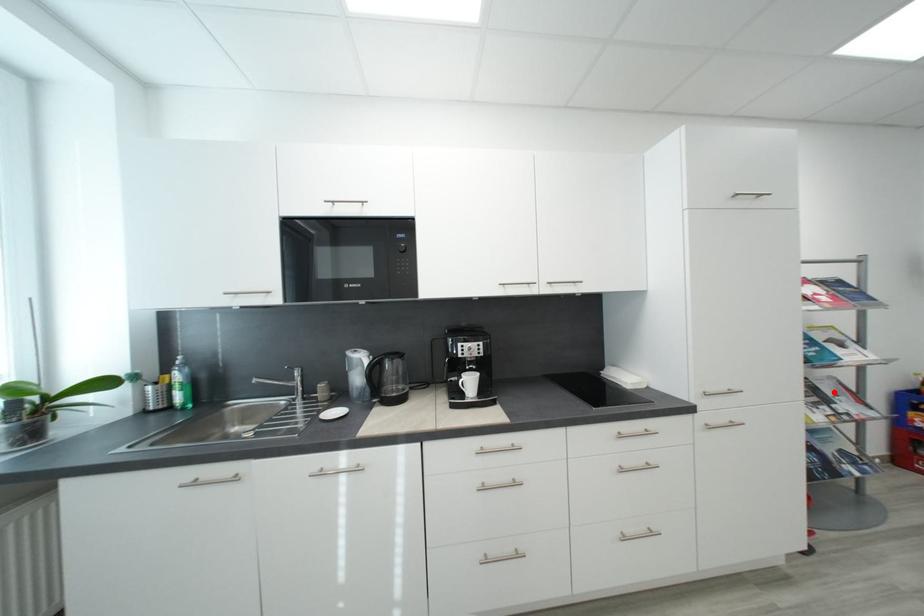
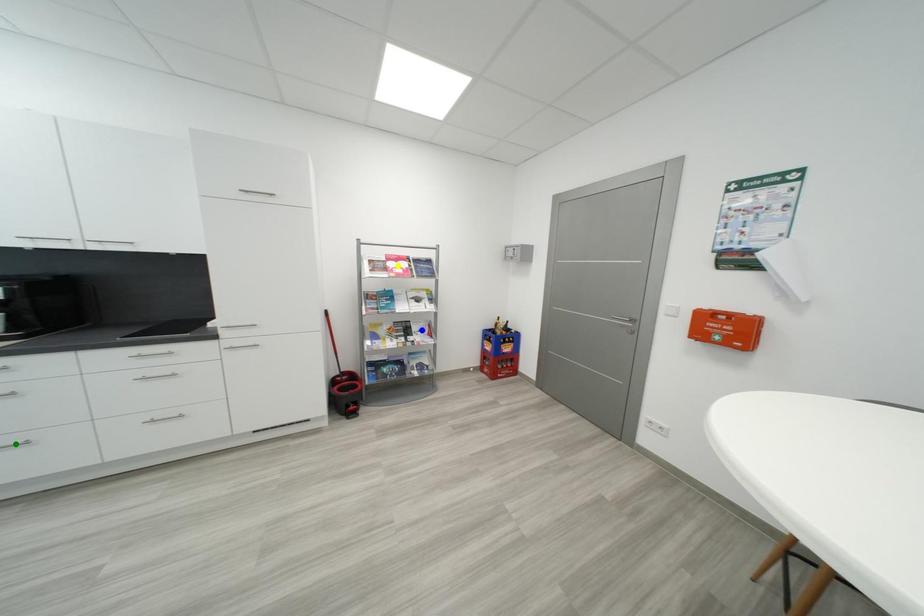
Question: I am providing you with two images of the same scene from different viewpoints. A red point is marked on the first image. You are given multiple points on the second image. In image 2, which mark is for the same physical point as the one in image 1?

Choices:
 (A) green point
 (B) blue point
 (C) yellow point

Answer: (B)